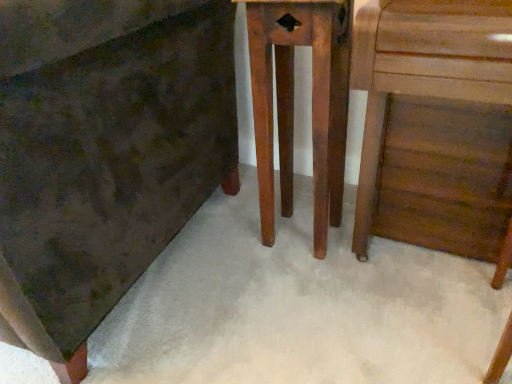
I want to click on wooden table at center, so click(293, 103).

In order to face wooden table at center, should I rotate leftwards or rightwards?

Turn right approximately 6.354 degrees to face it.

What is the approximate height of wooden table at center?

wooden table at center is 29.36 inches tall.

The image size is (512, 384). Describe the element at coordinates (293, 103) in the screenshot. I see `wooden table at center` at that location.

Describe the element at coordinates (103, 152) in the screenshot. I see `wooden chest of drawers at center` at that location.

In order to face wooden chest of drawers at center, should I rotate leftwards or rightwards?

To face it directly, rotate left by 33.725 degrees.

Identify the location of wooden chest of drawers at center. (103, 152).

Image resolution: width=512 pixels, height=384 pixels. Identify the location of wooden table at center. (293, 103).

Consider the image. Which is more to the left, wooden chest of drawers at center or wooden table at center?

wooden chest of drawers at center.

Is wooden chest of drawers at center positioned behind wooden table at center?

No, wooden chest of drawers at center is in front of wooden table at center.

Which is behind, point (221, 73) or point (343, 179)?

The point (343, 179) is farther.

From the image's perspective, would you say wooden chest of drawers at center is shown under wooden table at center?

No, from the image's perspective, wooden chest of drawers at center is not beneath wooden table at center.

From a real-world perspective, who is located higher, wooden chest of drawers at center or wooden table at center?

wooden chest of drawers at center.

From the picture: Which of these two, wooden chest of drawers at center or wooden table at center, is thinner?

wooden table at center is thinner.

Based on the photo, which of these two, wooden chest of drawers at center or wooden table at center, stands taller?

With more height is wooden chest of drawers at center.

Is wooden chest of drawers at center smaller than wooden table at center?

Actually, wooden chest of drawers at center might be larger than wooden table at center.

Is wooden chest of drawers at center inside the boundaries of wooden table at center, or outside?

wooden chest of drawers at center is outside wooden table at center.

Is wooden chest of drawers at center not close to wooden table at center?

No, wooden chest of drawers at center is in close proximity to wooden table at center.

Looking at this image, is wooden table at center at the back of wooden chest of drawers at center?

No, wooden chest of drawers at center is not facing away from wooden table at center.

Where is `the chest of drawers that appears in front of the wooden table at center`? the chest of drawers that appears in front of the wooden table at center is located at coordinates (103, 152).

Which object is positioned more to the left, wooden table at center or wooden chest of drawers at center?

Positioned to the left is wooden chest of drawers at center.

Who is more distant, wooden table at center or wooden chest of drawers at center?

wooden table at center is behind.

Is point (286, 67) less distant than point (113, 106)?

No, it is behind (113, 106).

From the image's perspective, which one is positioned lower, wooden table at center or wooden chest of drawers at center?

wooden table at center appears lower in the image.

From a real-world perspective, does wooden table at center sit lower than wooden chest of drawers at center?

Yes, from a real-world perspective, wooden table at center is below wooden chest of drawers at center.

In terms of width, does wooden table at center look wider or thinner when compared to wooden chest of drawers at center?

Considering their sizes, wooden table at center looks slimmer than wooden chest of drawers at center.

In the scene shown: Considering the relative sizes of wooden table at center and wooden chest of drawers at center in the image provided, is wooden table at center taller than wooden chest of drawers at center?

Incorrect, the height of wooden table at center is not larger of that of wooden chest of drawers at center.

Considering the sizes of objects wooden table at center and wooden chest of drawers at center in the image provided, who is bigger, wooden table at center or wooden chest of drawers at center?

Bigger between the two is wooden chest of drawers at center.

Is wooden chest of drawers at center surrounded by wooden table at center?

No.

Is wooden table at center next to wooden chest of drawers at center and touching it?

No, wooden table at center is not touching wooden chest of drawers at center.

Could you tell me if wooden table at center is facing wooden chest of drawers at center?

No, wooden table at center is not facing towards wooden chest of drawers at center.

Locate an element on the screen. The image size is (512, 384). furniture behind the wooden chest of drawers at center is located at coordinates (293, 103).

This screenshot has width=512, height=384. What are the coordinates of `chest of drawers on the left side of wooden table at center` in the screenshot? It's located at coord(103,152).

Identify the location of furniture below the wooden chest of drawers at center (from a real-world perspective). This screenshot has height=384, width=512. (293, 103).